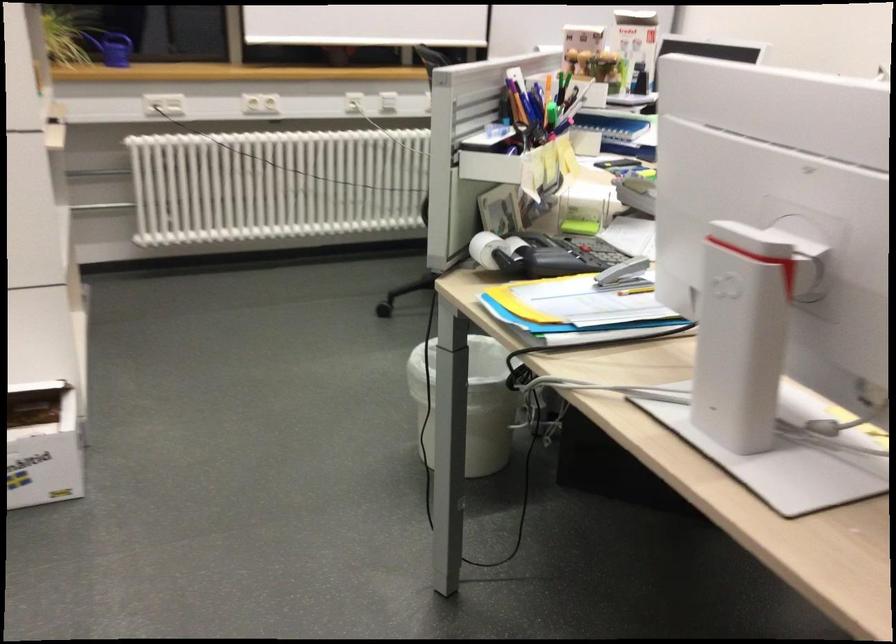
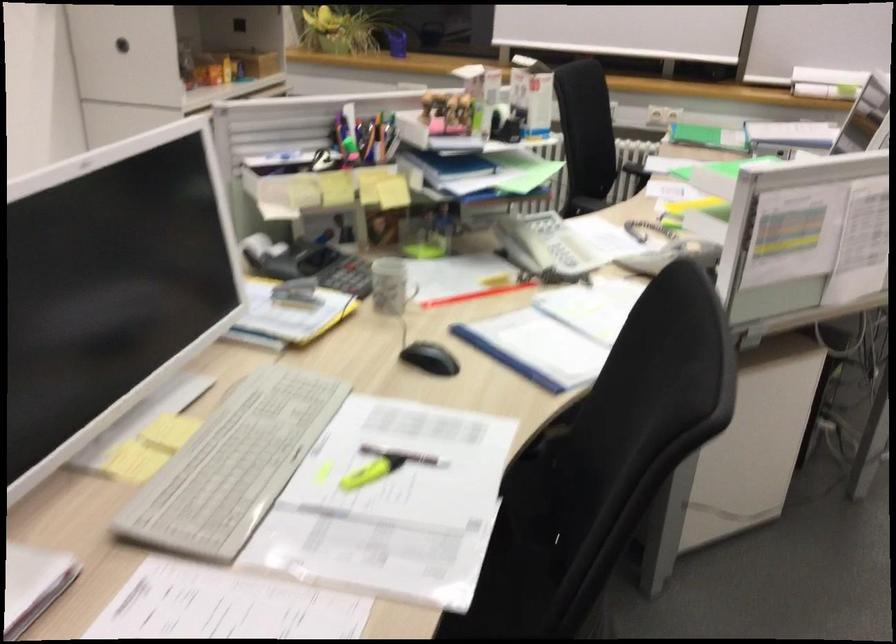
Where in the second image is the point corresponding to pixel 605 251 from the first image?

(348, 276)